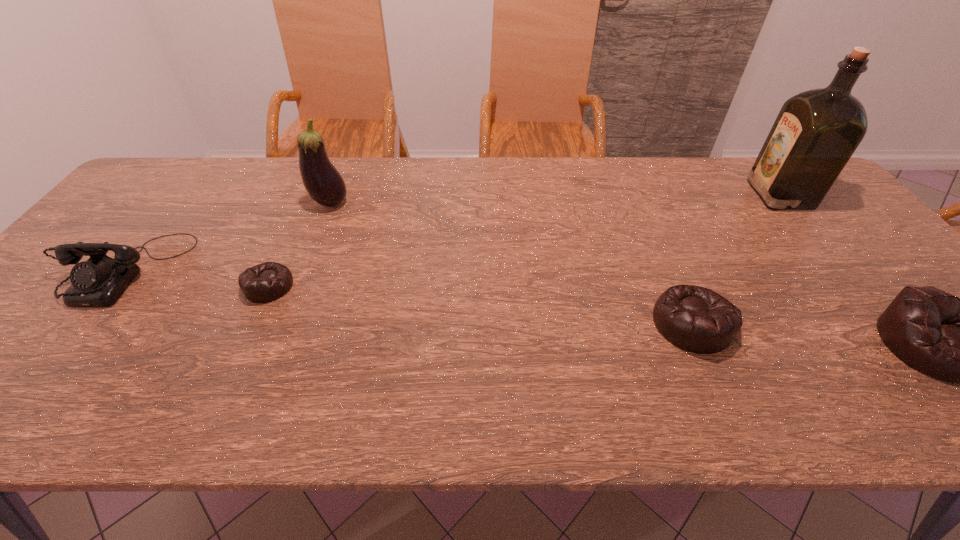
Where is `free space located 0.230m on the label of the tallest object`? free space located 0.230m on the label of the tallest object is located at coordinates [680, 194].

Where is `free space located on the label of the tallest object`? free space located on the label of the tallest object is located at coordinates (680, 194).

Locate an element on the screen. Image resolution: width=960 pixels, height=540 pixels. blank area located on the label of the tallest object is located at coordinates (650, 194).

At what (x,y) coordinates should I click in order to perform the action: click on free space located on the front-facing side of the telephone. Please return your answer as a coordinate pair (x, y). Looking at the image, I should click on (67, 341).

Locate an element on the screen. The height and width of the screenshot is (540, 960). eggplant located at the far edge is located at coordinates (324, 184).

Find the location of a particular element. liquor positioned at the far edge is located at coordinates (816, 132).

This screenshot has width=960, height=540. I want to click on object present at the near edge, so click(696, 319).

The width and height of the screenshot is (960, 540). I want to click on object that is at the left edge, so click(x=98, y=282).

Find the location of `object that is at the right edge`. object that is at the right edge is located at coordinates (816, 132).

At what (x,y) coordinates should I click in order to perform the action: click on object positioned at the far right corner. Please return your answer as a coordinate pair (x, y). Image resolution: width=960 pixels, height=540 pixels. Looking at the image, I should click on (816, 132).